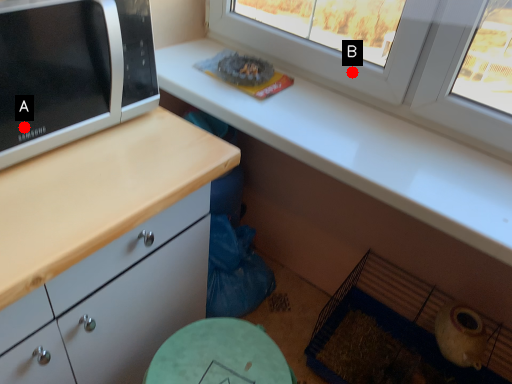
Question: Two points are circled on the image, labeled by A and B beside each circle. Which point appears farthest from the camera in this image?

Choices:
 (A) A is further
 (B) B is further

Answer: (B)